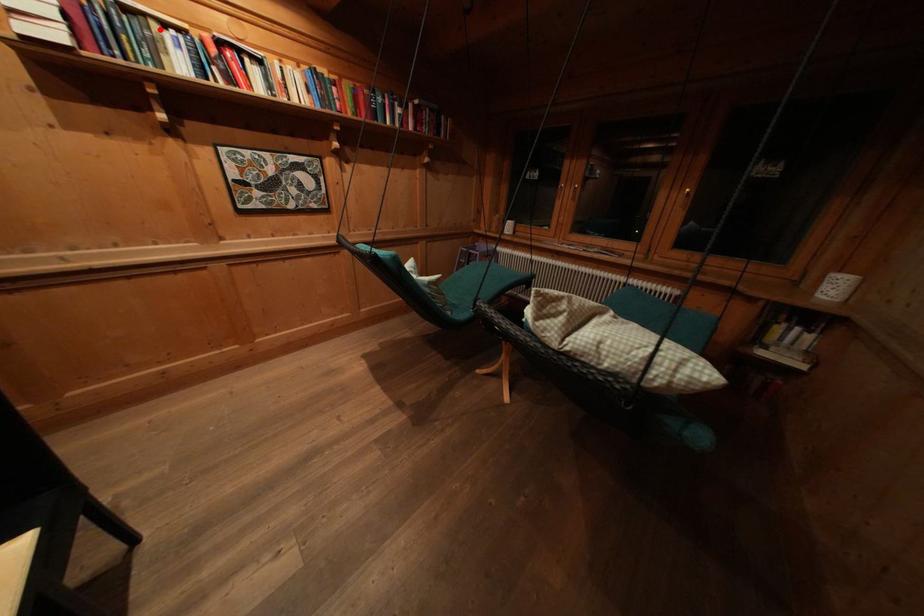
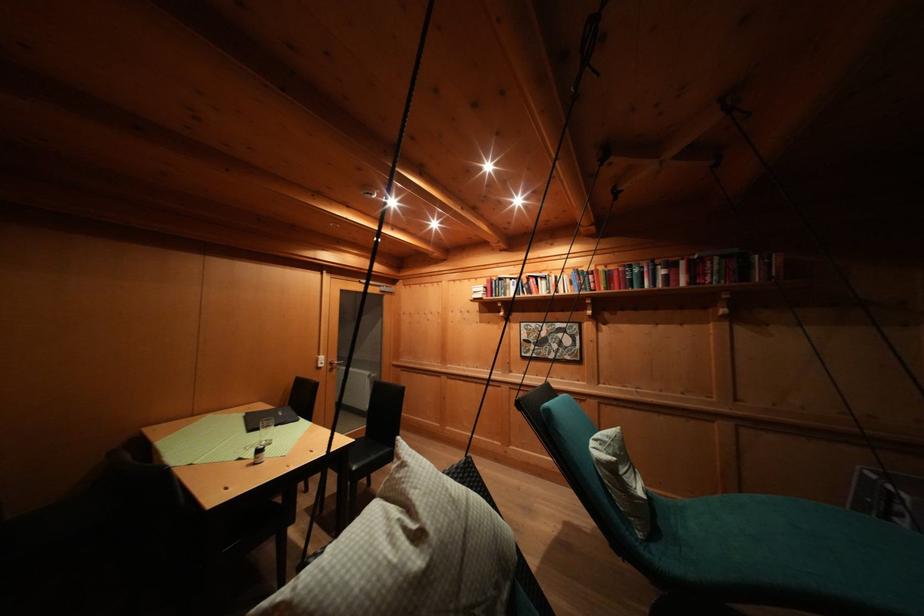
The point at the highlighted location is marked in the first image. Where is the corresponding point in the second image?

(514, 285)